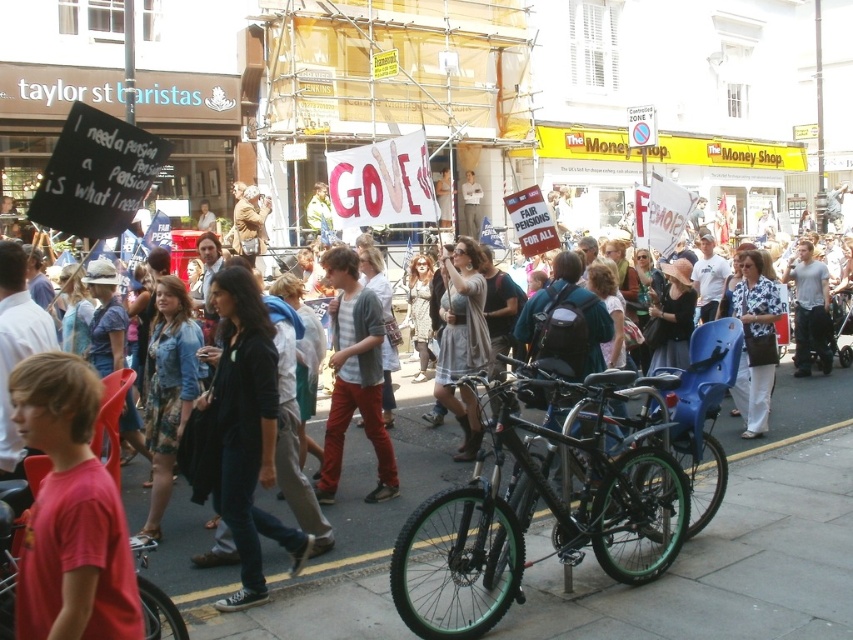
Is red matte shirt at lower left to the right of white cotton dress at center from the viewer's perspective?

No, red matte shirt at lower left is not to the right of white cotton dress at center.

Which of these two, red matte shirt at lower left or white cotton dress at center, stands shorter?

Standing shorter between the two is red matte shirt at lower left.

This screenshot has width=853, height=640. What do you see at coordinates (70, 513) in the screenshot?
I see `red matte shirt at lower left` at bounding box center [70, 513].

In order to click on red matte shirt at lower left in this screenshot , I will do `click(70, 513)`.

Which is below, striped cotton shirt at center or white cotton dress at center?

striped cotton shirt at center is below.

Which is more to the left, striped cotton shirt at center or white cotton dress at center?

From the viewer's perspective, striped cotton shirt at center appears more on the left side.

Is point (361, 305) less distant than point (747, 408)?

Yes.

At what (x,y) coordinates should I click in order to perform the action: click on striped cotton shirt at center. Please return your answer as a coordinate pair (x, y). Looking at the image, I should click on (354, 376).

Can you confirm if striped cotton shirt at center is bigger than light gray dress at center?

No, striped cotton shirt at center is not bigger than light gray dress at center.

Consider the image. Is striped cotton shirt at center in front of light gray dress at center?

Yes, striped cotton shirt at center is closer to the viewer.

Between point (331, 266) and point (436, 372), which one is positioned in front?

Point (331, 266)

At what (x,y) coordinates should I click in order to perform the action: click on striped cotton shirt at center. Please return your answer as a coordinate pair (x, y). Looking at the image, I should click on 354,376.